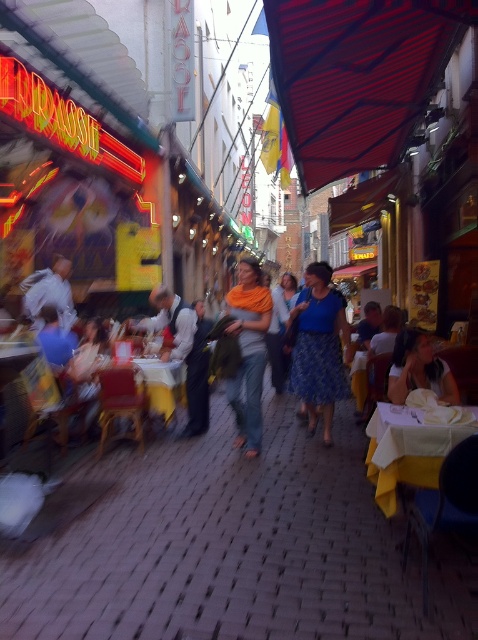
Question: Which object appears farthest from the camera in this image?

Choices:
 (A) white fabric shirt at center
 (B) red fabric canopy at upper center
 (C) orange scarf at center
 (D) wooden table at center

Answer: (D)

Question: Where is blue printed skirt at center located in relation to white fabric shirt at center in the image?

Choices:
 (A) left
 (B) right

Answer: (A)

Question: Is red fabric canopy at upper center below white/yellow fabric table at center?

Choices:
 (A) no
 (B) yes

Answer: (A)

Question: Which point is farther to the camera?

Choices:
 (A) (346, 45)
 (B) (417, 448)

Answer: (A)

Question: Among these objects, which one is nearest to the camera?

Choices:
 (A) dark blue dress at center
 (B) white/yellow fabric table at center
 (C) orange scarf at center

Answer: (B)

Question: Does white fabric shirt at center appear over wooden table at center?

Choices:
 (A) yes
 (B) no

Answer: (A)